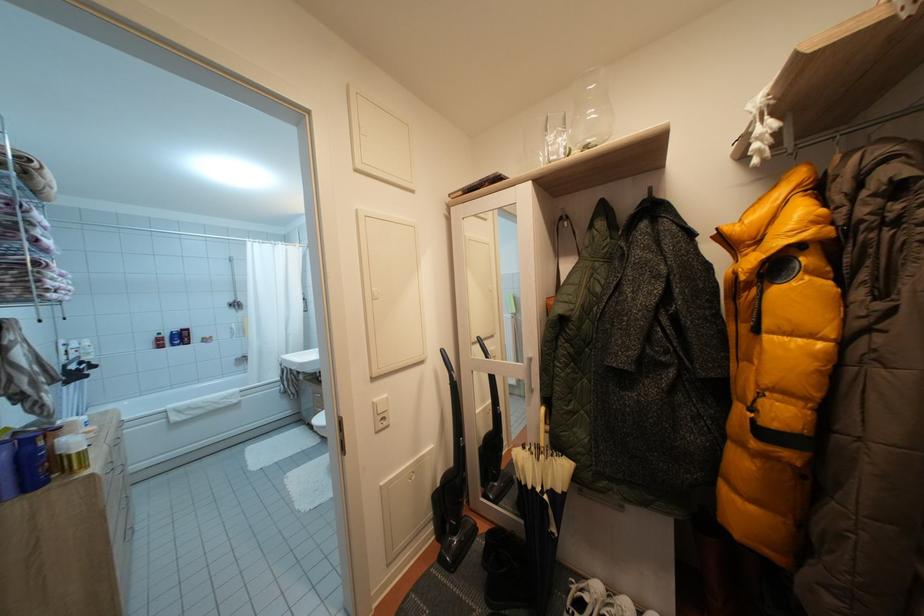
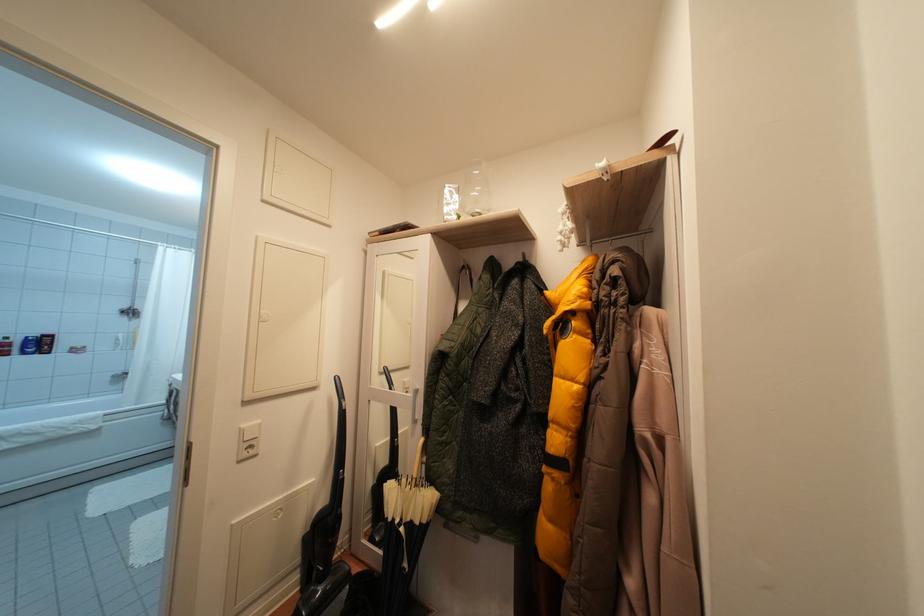
In the second image, find the point that corresponds to point 383,406 in the first image.

(250, 431)